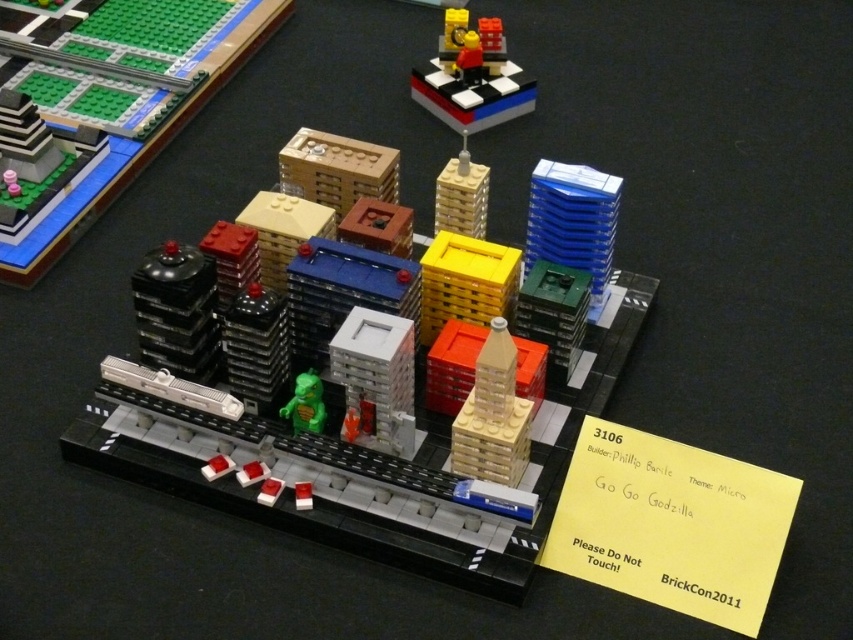
Question: Among these objects, which one is farthest from the camera?

Choices:
 (A) light brown plastic building at center
 (B) yellow matte tower at center
 (C) smooth plastic cityscape at center
 (D) blue plastic building at upper right

Answer: (A)

Question: Is brick-like figure at upper center smaller than yellow matte building at center?

Choices:
 (A) no
 (B) yes

Answer: (A)

Question: Which point is farther to the camera?

Choices:
 (A) (233, 424)
 (B) (465, 35)
 (C) (440, 225)
 (D) (293, 397)

Answer: (B)

Question: Is brick-like figure at upper center closer to the viewer compared to blue plastic building at upper right?

Choices:
 (A) yes
 (B) no

Answer: (B)

Question: Which point is farther to the camera?

Choices:
 (A) light brown plastic tower at center
 (B) shiny black dome at left

Answer: (B)

Question: Can you confirm if light brown plastic tower at center is positioned to the right of yellow matte tower at center?

Choices:
 (A) no
 (B) yes

Answer: (B)